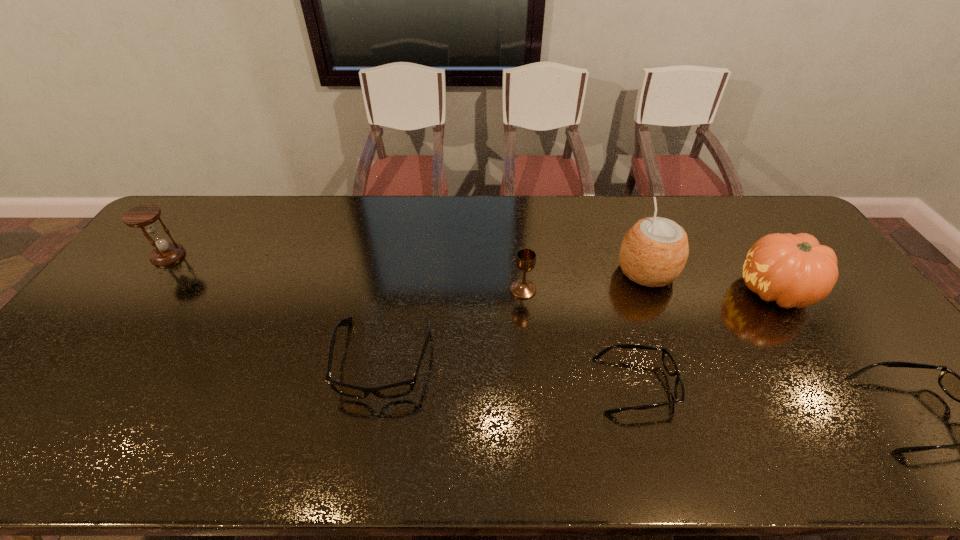
Where is `free point that keeps the spectacless evenly spaced on the left`? This screenshot has width=960, height=540. free point that keeps the spectacless evenly spaced on the left is located at coordinates (153, 335).